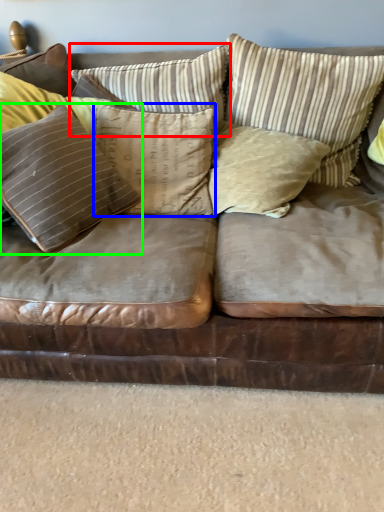
Question: Estimate the real-world distances between objects in this image. Which object is closer to pillow (highlighted by a red box), pillow (highlighted by a blue box) or pillow (highlighted by a green box)?

Choices:
 (A) pillow
 (B) pillow

Answer: (A)